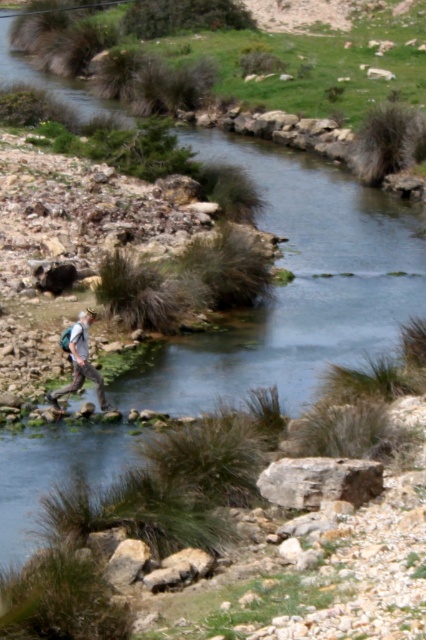
Question: Where is clear water stream at center located in relation to rusty metallic rock at center in the image?

Choices:
 (A) above
 (B) below

Answer: (A)

Question: Which object is closer to the camera taking this photo?

Choices:
 (A) light gray backpack at left
 (B) clear water stream at center
 (C) rusty metallic rock at center

Answer: (C)

Question: Is clear water stream at center to the right of light gray backpack at left from the viewer's perspective?

Choices:
 (A) no
 (B) yes

Answer: (A)

Question: Which of the following is the farthest from the observer?

Choices:
 (A) clear water stream at center
 (B) light gray backpack at left
 (C) rusty metallic rock at center

Answer: (A)

Question: Which is farther from the light gray backpack at left?

Choices:
 (A) rusty metallic rock at center
 (B) clear water stream at center

Answer: (B)

Question: Can you confirm if clear water stream at center is positioned to the left of light gray backpack at left?

Choices:
 (A) yes
 (B) no

Answer: (A)